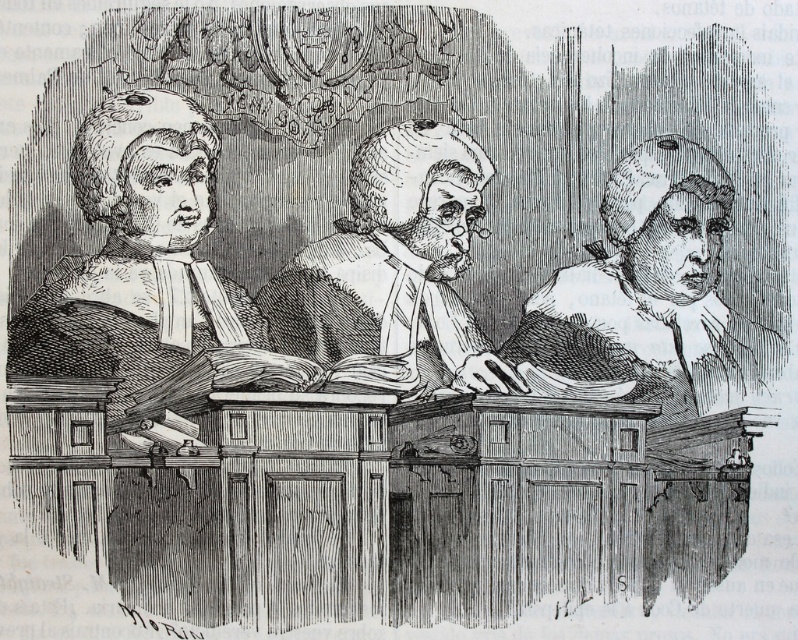
Question: Can you confirm if matte black wig at center is smaller than smooth gray wig at center?

Choices:
 (A) yes
 (B) no

Answer: (A)

Question: From the image, what is the correct spatial relationship of matte black wig at center in relation to smooth gray wig at center?

Choices:
 (A) right
 (B) left

Answer: (B)

Question: Is matte black wig at center positioned in front of smooth parchment document at center?

Choices:
 (A) yes
 (B) no

Answer: (A)

Question: Which point is farther to the camera?

Choices:
 (A) [85, 122]
 (B) [425, 144]

Answer: (B)

Question: Estimate the real-world distances between objects in this image. Which object is closer to the smooth parchment document at center?

Choices:
 (A) smooth gray wig at center
 (B) matte black wig at center

Answer: (B)

Question: Which point is closer to the camera?

Choices:
 (A) matte black wig at center
 (B) smooth parchment document at center
 (C) smooth gray wig at center

Answer: (A)